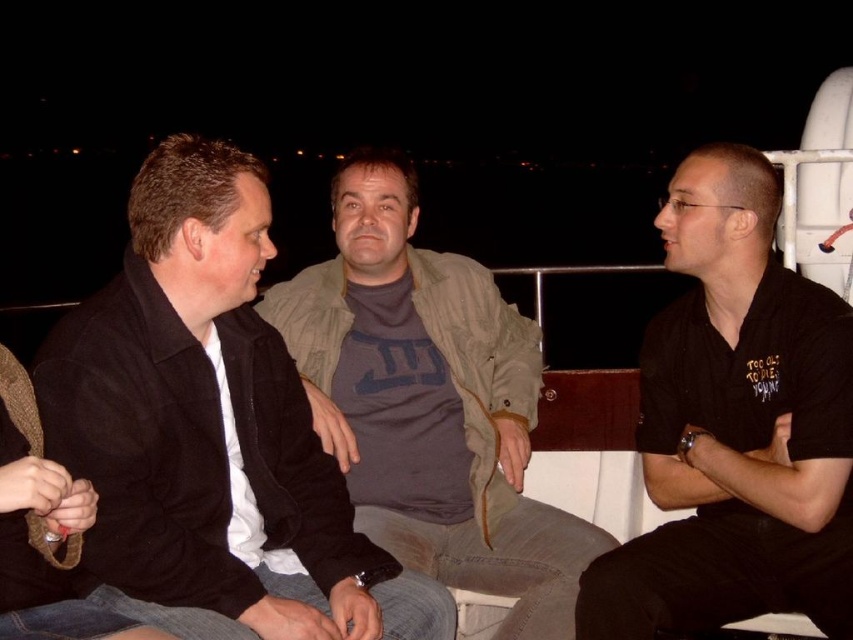
Does black matte jacket at left appear over dark gray cotton shirt at center?

No.

Locate an element on the screen. This screenshot has height=640, width=853. black matte jacket at left is located at coordinates point(212,428).

Is point (364, 566) in front of point (422, 516)?

Yes.

The width and height of the screenshot is (853, 640). In order to click on black matte jacket at left in this screenshot , I will do `click(212, 428)`.

Who is positioned more to the right, black matte jacket at left or black matte shirt at center?

black matte shirt at center

At what (x,y) coordinates should I click in order to perform the action: click on black matte jacket at left. Please return your answer as a coordinate pair (x, y). Looking at the image, I should click on (212, 428).

Who is more forward, (804,493) or (549,552)?

Positioned in front is point (804,493).

Measure the distance between black matte shirt at center and dark gray cotton shirt at center.

black matte shirt at center and dark gray cotton shirt at center are 73.40 centimeters apart from each other.

Is point (723, 579) behind point (509, 508)?

No.

Find the location of a particular element. black matte shirt at center is located at coordinates (735, 426).